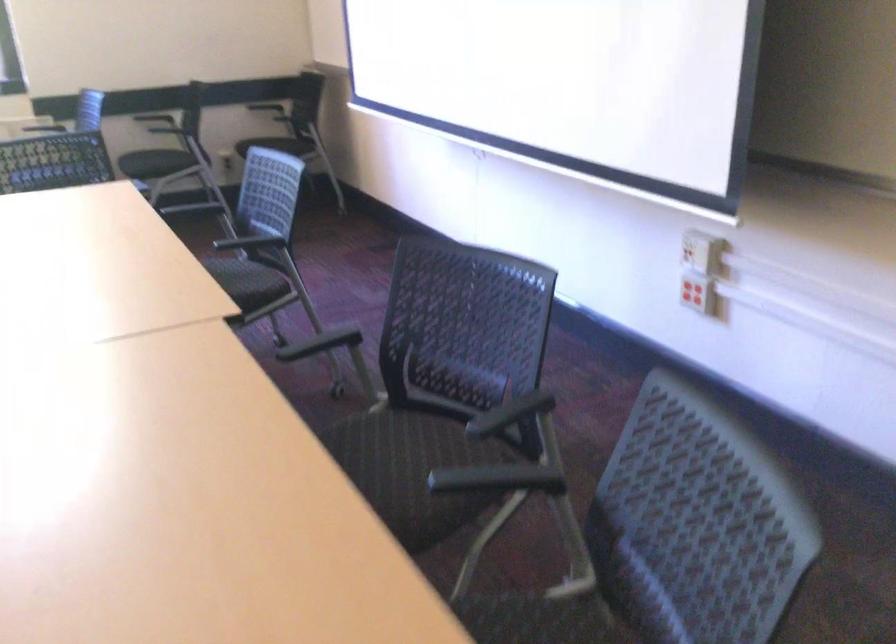
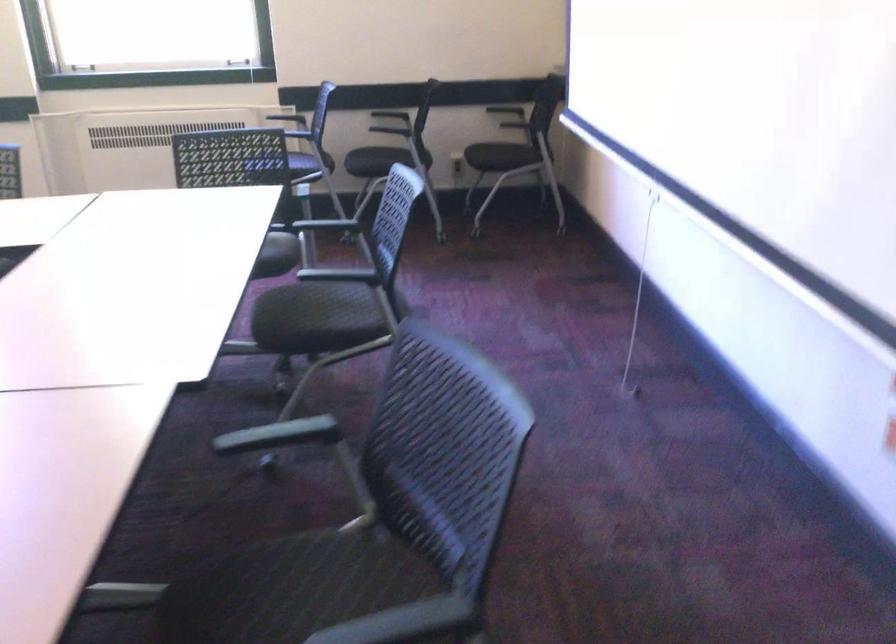
Question: The first image is from the beginning of the video and the second image is from the end. How did the camera likely rotate when shooting the video?

Choices:
 (A) Left
 (B) Right
 (C) Up
 (D) Down

Answer: (A)